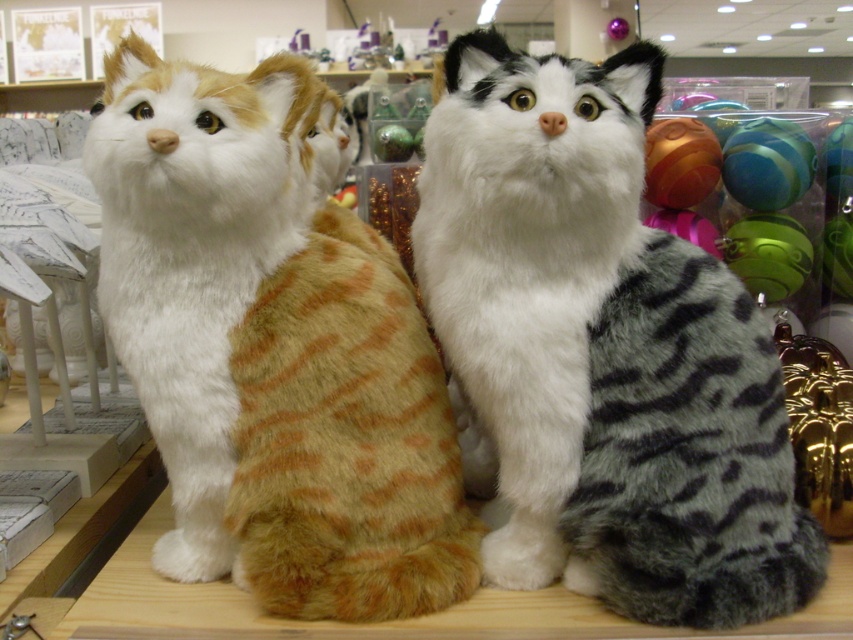
Looking at this image, you are a customer in the store looking at the two cat toys on the shelf. You want to pick up the cat toy that is closer to you. Which one should you choose between the point at (x=543, y=438) and the point at (x=252, y=342)?

The point at (x=543, y=438) is closer to the viewer than the point at (x=252, y=342), so you should choose the cat toy at point (x=543, y=438).